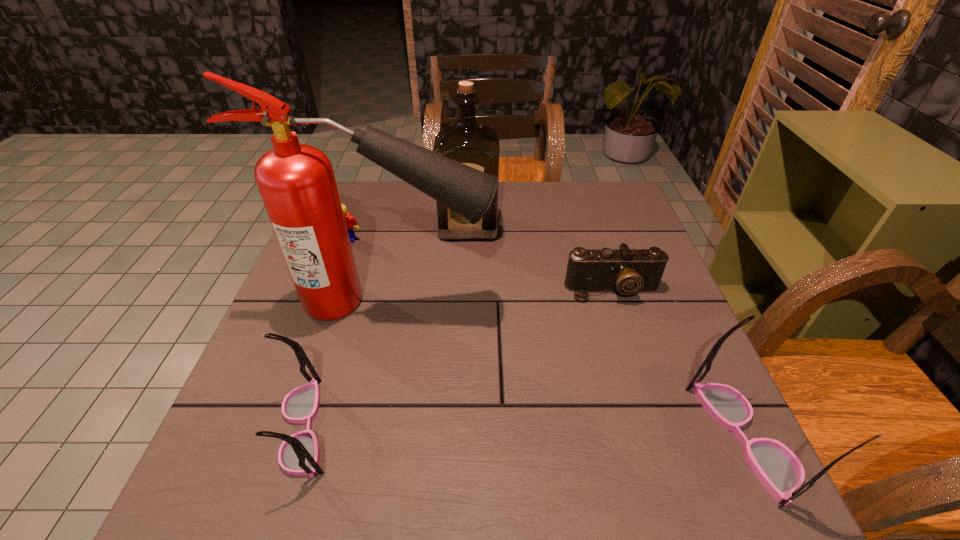
At what (x,y) coordinates should I click in order to perform the action: click on object at the near left corner. Please return your answer as a coordinate pair (x, y). This screenshot has height=540, width=960. Looking at the image, I should click on (298, 455).

Locate an element on the screen. object that is at the near right corner is located at coordinates (779, 470).

This screenshot has width=960, height=540. Identify the location of free spot at the far edge of the desktop. (553, 215).

Identify the location of vacant space at the near edge of the desktop. (382, 421).

Find the location of a particular element. vacant point at the left edge is located at coordinates (297, 384).

The height and width of the screenshot is (540, 960). In the image, there is a desktop. Identify the location of free space at the right edge. (614, 325).

In the image, there is a desktop. Where is `blank space at the far left corner`? blank space at the far left corner is located at coordinates (375, 205).

At what (x,y) coordinates should I click in order to perform the action: click on vacant space at the far right corner of the desktop. Please return your answer as a coordinate pair (x, y). Looking at the image, I should click on (582, 181).

I want to click on free point between the right spectacles and the camera, so click(x=679, y=364).

The width and height of the screenshot is (960, 540). What are the coordinates of `free space between the left spectacles and the fire extinguisher` in the screenshot? It's located at (347, 364).